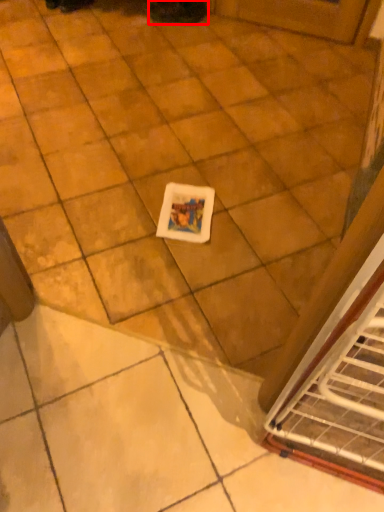
Question: From the image, what is the correct spatial relationship of footwear (annotated by the red box) in relation to ceramic tile?

Choices:
 (A) left
 (B) right

Answer: (B)